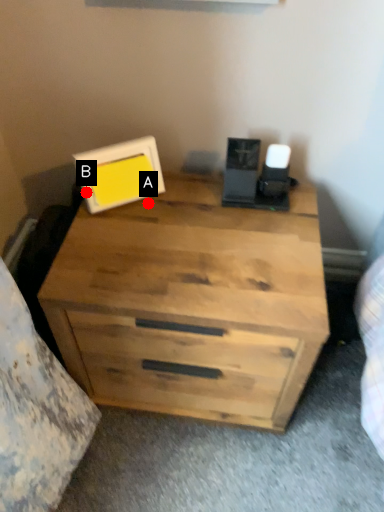
Question: Two points are circled on the image, labeled by A and B beside each circle. Among these points, which one is nearest to the camera?

Choices:
 (A) A is closer
 (B) B is closer

Answer: (B)